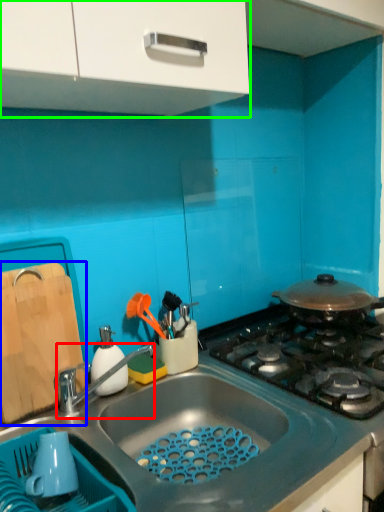
Question: Which object is the closest to the tap (highlighted by a red box)? Choose among these: cutting board (highlighted by a blue box) or cabinetry (highlighted by a green box).

Choices:
 (A) cutting board
 (B) cabinetry

Answer: (A)